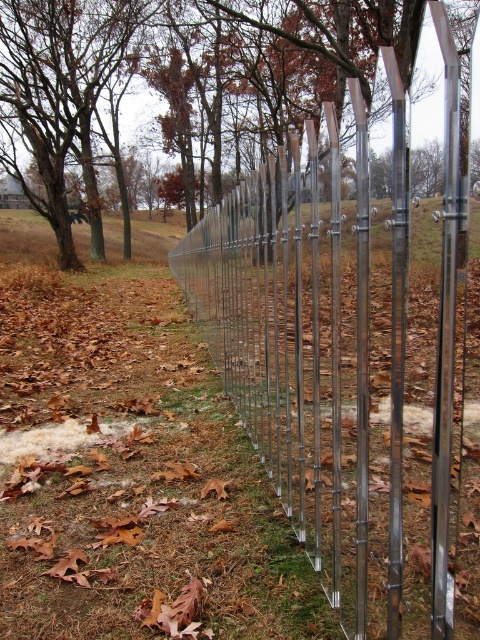
Based on the photo, is metallic silver fence at center to the right of polished metal pole at center from the viewer's perspective?

Incorrect, metallic silver fence at center is not on the right side of polished metal pole at center.

Locate an element on the screen. The image size is (480, 640). metallic silver fence at center is located at coordinates (356, 342).

Between point (415, 292) and point (444, 429), which one is positioned behind?

Point (415, 292)

The height and width of the screenshot is (640, 480). I want to click on metallic silver fence at center, so click(x=356, y=342).

Does metallic silver fence at center appear on the left side of metallic silver pole at center?

Yes, metallic silver fence at center is to the left of metallic silver pole at center.

Is point (445, 211) more distant than point (363, 568)?

That is False.

Identify the location of metallic silver fence at center. The width and height of the screenshot is (480, 640). (356, 342).

The width and height of the screenshot is (480, 640). I want to click on metallic silver fence at center, so click(x=356, y=342).

Between polished metal pole at center and metallic silver pole at center, which one appears on the left side from the viewer's perspective?

From the viewer's perspective, metallic silver pole at center appears more on the left side.

Consider the image. Who is more distant from viewer, (444, 442) or (363, 216)?

The point (363, 216) is more distant.

Image resolution: width=480 pixels, height=640 pixels. What do you see at coordinates (444, 337) in the screenshot?
I see `polished metal pole at center` at bounding box center [444, 337].

Where is `polished metal pole at center`? This screenshot has height=640, width=480. polished metal pole at center is located at coordinates (444, 337).